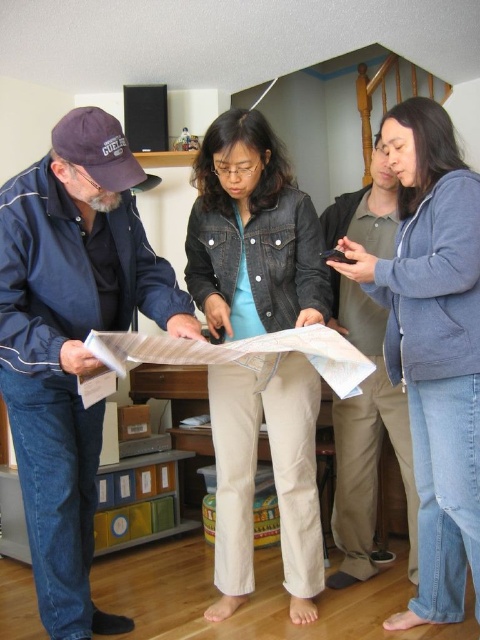
Question: Is blue fleece jacket at upper right positioned behind white paper at center?

Choices:
 (A) yes
 (B) no

Answer: (A)

Question: Which object appears closest to the camera in this image?

Choices:
 (A) white paper at center
 (B) blue fabric jacket at left
 (C) denim jacket at center
 (D) blue fleece jacket at upper right

Answer: (A)

Question: Is denim jacket at center to the left of white paper at center from the viewer's perspective?

Choices:
 (A) yes
 (B) no

Answer: (B)

Question: Observing the image, what is the correct spatial positioning of blue fleece jacket at upper right in reference to white paper at center?

Choices:
 (A) left
 (B) right

Answer: (B)

Question: Which point is farther to the camera?

Choices:
 (A) blue fabric jacket at left
 (B) white paper at center

Answer: (A)

Question: Among these points, which one is nearest to the camera?

Choices:
 (A) (57, 358)
 (B) (80, 387)

Answer: (A)